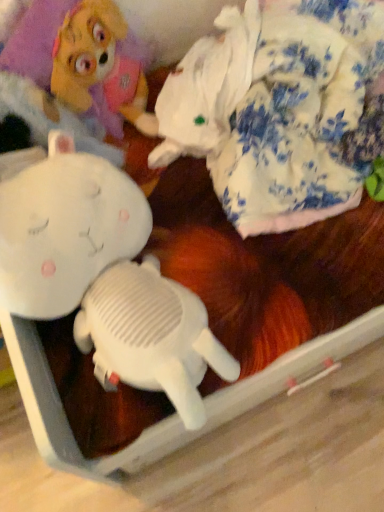
Question: Do you think white plush toy at upper left is within white plush rabbit at upper left, placed as the 3th toy when sorted from right to left, or outside of it?

Choices:
 (A) inside
 (B) outside

Answer: (A)

Question: Is white plush toy at upper left wider or thinner than white plush rabbit at upper left, positioned as the 2th toy in left-to-right order?

Choices:
 (A) thin
 (B) wide

Answer: (A)

Question: Estimate the real-world distances between objects in this image. Which object is farther from the white plush toy at upper left?

Choices:
 (A) fluffy white blanket at upper right, which is counted as the fourth toy, starting from the left
 (B) white plush toy at center, marked as the first toy in a left-to-right arrangement
 (C) white plush rabbit at upper left, placed as the 3th toy when sorted from right to left
 (D) white matte toy at center, marked as the second toy in a right-to-left arrangement

Answer: (A)

Question: Estimate the real-world distances between objects in this image. Which object is closer to the white plush toy at upper left?

Choices:
 (A) fluffy white blanket at upper right, which is counted as the fourth toy, starting from the left
 (B) white matte toy at center, marked as the second toy in a right-to-left arrangement
 (C) white plush rabbit at upper left, positioned as the 2th toy in left-to-right order
 (D) white plush toy at center, marked as the first toy in a left-to-right arrangement

Answer: (C)